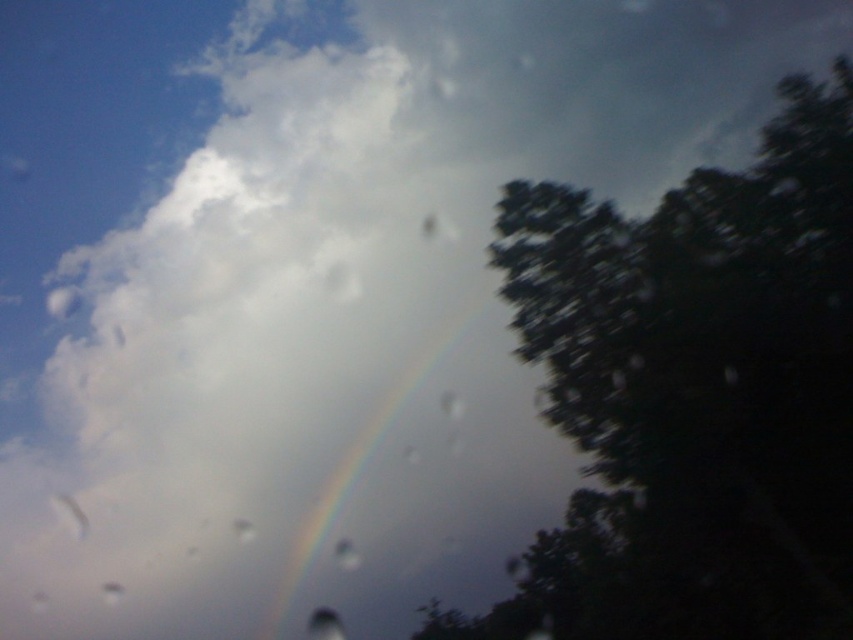
Question: Which point is closer to the camera?

Choices:
 (A) (569, 403)
 (B) (395, 401)

Answer: (A)

Question: Can you confirm if dark green leafy tree at right is positioned to the right of rainbow at center?

Choices:
 (A) no
 (B) yes

Answer: (B)

Question: Does dark green leafy tree at right appear on the right side of rainbow at center?

Choices:
 (A) yes
 (B) no

Answer: (A)

Question: Which object appears closest to the camera in this image?

Choices:
 (A) rainbow at center
 (B) dark green leafy tree at right

Answer: (B)

Question: Does dark green leafy tree at right have a larger size compared to rainbow at center?

Choices:
 (A) no
 (B) yes

Answer: (B)